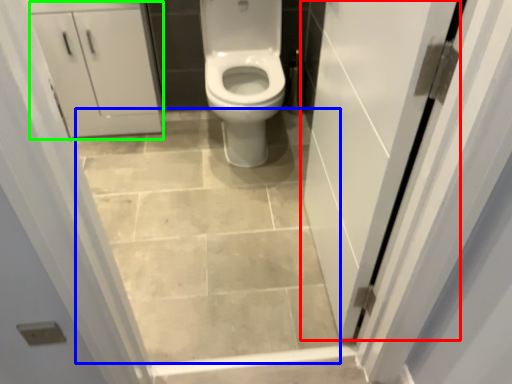
Question: Considering the real-world distances, which object is farthest from door (highlighted by a red box)? ceramic tile (highlighted by a blue box) or cabinetry (highlighted by a green box)?

Choices:
 (A) ceramic tile
 (B) cabinetry

Answer: (B)